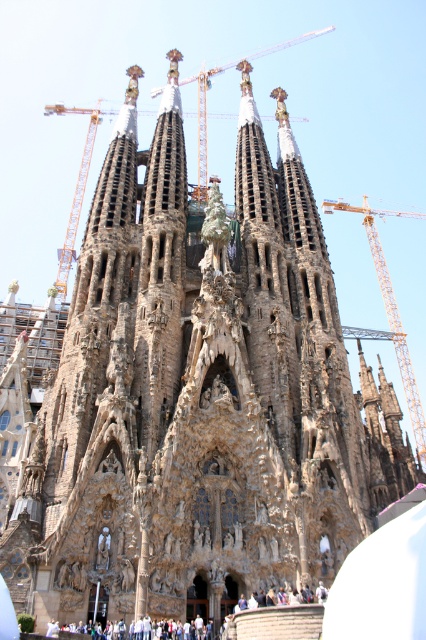
Who is more forward, (77,211) or (331,211)?

Positioned in front is point (77,211).

Based on the photo, does orange metallic crane at upper center have a larger size compared to yellow metal crane at right?

Correct, orange metallic crane at upper center is larger in size than yellow metal crane at right.

Where is `orange metallic crane at upper center`? The image size is (426, 640). orange metallic crane at upper center is located at coordinates (74, 189).

Image resolution: width=426 pixels, height=640 pixels. Find the location of `orange metallic crane at upper center`. orange metallic crane at upper center is located at coordinates (74, 189).

Which is above, yellow metal crane at right or white cotton shirt at lower center?

yellow metal crane at right is higher up.

Based on the photo, who is positioned more to the right, yellow metal crane at right or white cotton shirt at lower center?

Positioned to the right is yellow metal crane at right.

This screenshot has width=426, height=640. I want to click on yellow metal crane at right, so click(391, 314).

From the picture: Between orange metallic crane at upper center and white cotton shirt at lower center, which one is positioned lower?

white cotton shirt at lower center

Does orange metallic crane at upper center appear under white cotton shirt at lower center?

No.

Which is in front, point (86, 145) or point (184, 636)?

Point (184, 636)

Locate an element on the screen. The width and height of the screenshot is (426, 640). orange metallic crane at upper center is located at coordinates (74, 189).